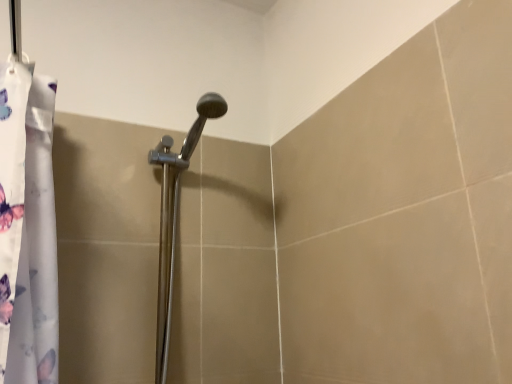
Question: Should I look upward or downward to see polished chrome shower head at center?

Choices:
 (A) down
 (B) up

Answer: (A)